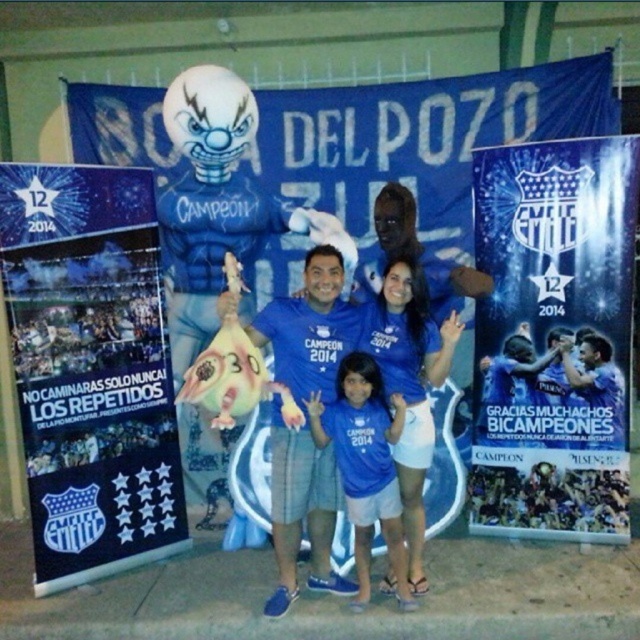
Question: Which is farther from the blue glossy poster at upper center?

Choices:
 (A) blue matte shirt at center
 (B) blue jersey at center
 (C) blue fabric banner at upper center

Answer: (B)

Question: Can you confirm if blue fabric banner at upper center is bigger than blue jersey at center?

Choices:
 (A) no
 (B) yes

Answer: (B)

Question: Does blue paper poster at left come behind blue jersey at center?

Choices:
 (A) yes
 (B) no

Answer: (A)

Question: Considering the real-world distances, which object is farthest from the blue jersey at center?

Choices:
 (A) blue paper poster at left
 (B) blue fabric banner at upper center

Answer: (B)

Question: Which of these objects is positioned closest to the blue fabric banner at upper center?

Choices:
 (A) blue jersey at center
 (B) blue paper poster at left

Answer: (A)

Question: Can you confirm if blue fabric banner at upper center is positioned below blue jersey at center?

Choices:
 (A) yes
 (B) no

Answer: (B)